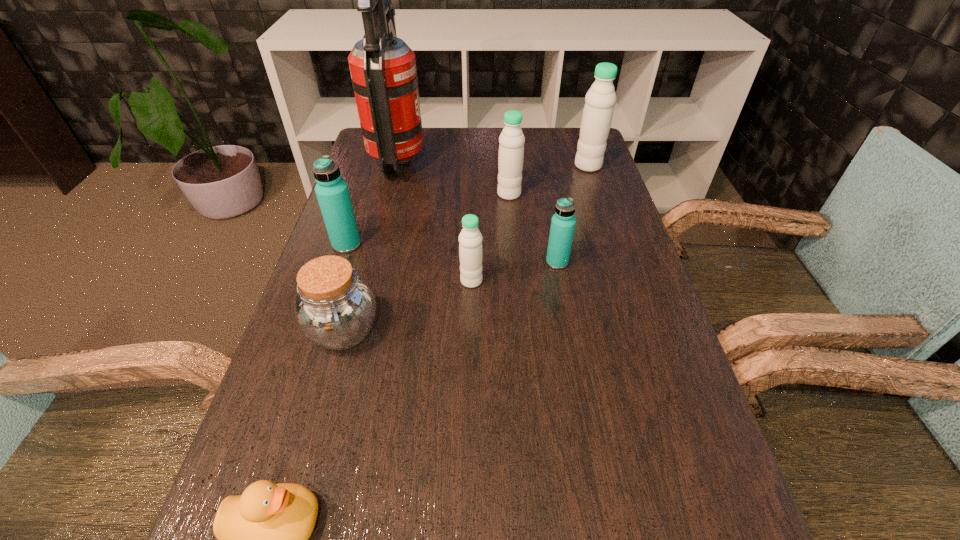
I want to click on fire extinguisher, so click(x=383, y=71).

I want to click on red fire extinguisher, so click(383, 71).

What are the coordinates of `the rightmost object` in the screenshot? It's located at (600, 99).

You are a GUI agent. You are given a task and a screenshot of the screen. Output one action in this format:
    pyautogui.click(x=<x>, y=<y>)
    Task: Click on the biggest white water bottle
    The image size is (960, 540).
    Given the screenshot: What is the action you would take?
    pyautogui.click(x=600, y=99)

The width and height of the screenshot is (960, 540). In order to click on the left blue water bottle in this screenshot , I will do `click(332, 192)`.

Find the location of a particular element. The height and width of the screenshot is (540, 960). the third farthest water bottle is located at coordinates (332, 192).

You are a GUI agent. You are given a task and a screenshot of the screen. Output one action in this format:
    pyautogui.click(x=<x>, y=<y>)
    Task: Click on the second nearest white water bottle
    This screenshot has height=540, width=960.
    Given the screenshot: What is the action you would take?
    pyautogui.click(x=511, y=148)

You are a GUI agent. You are given a task and a screenshot of the screen. Output one action in this format:
    pyautogui.click(x=<x>, y=<y>)
    Task: Click on the second white water bottle from right to left
    This screenshot has width=960, height=540.
    Given the screenshot: What is the action you would take?
    pyautogui.click(x=511, y=148)

Locate an element on the screen. The height and width of the screenshot is (540, 960). the second object from right to left is located at coordinates (563, 222).

Image resolution: width=960 pixels, height=540 pixels. Identify the location of the second water bottle from right to left. (563, 222).